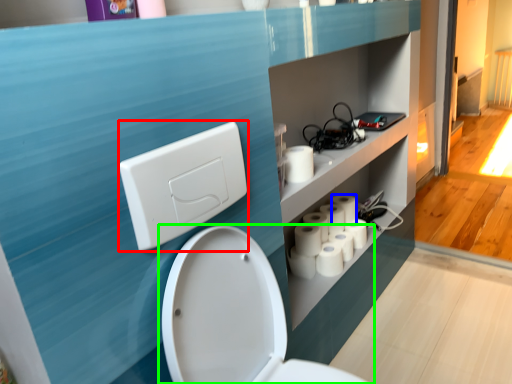
Question: Which object is the farthest from light switch (highlighted by a red box)? Choose among these: toilet paper (highlighted by a blue box) or toilet (highlighted by a green box).

Choices:
 (A) toilet paper
 (B) toilet

Answer: (A)